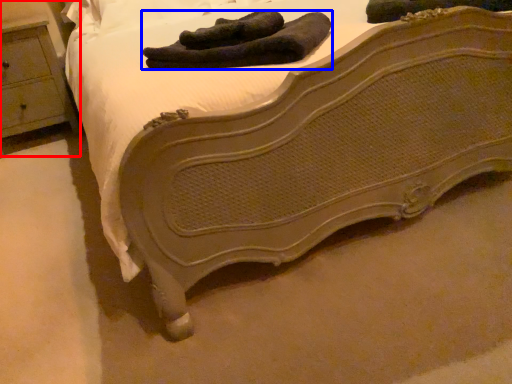
Question: Which point is closer to the camera, nightstand (highlighted by a red box) or footwear (highlighted by a blue box)?

Choices:
 (A) nightstand
 (B) footwear

Answer: (B)